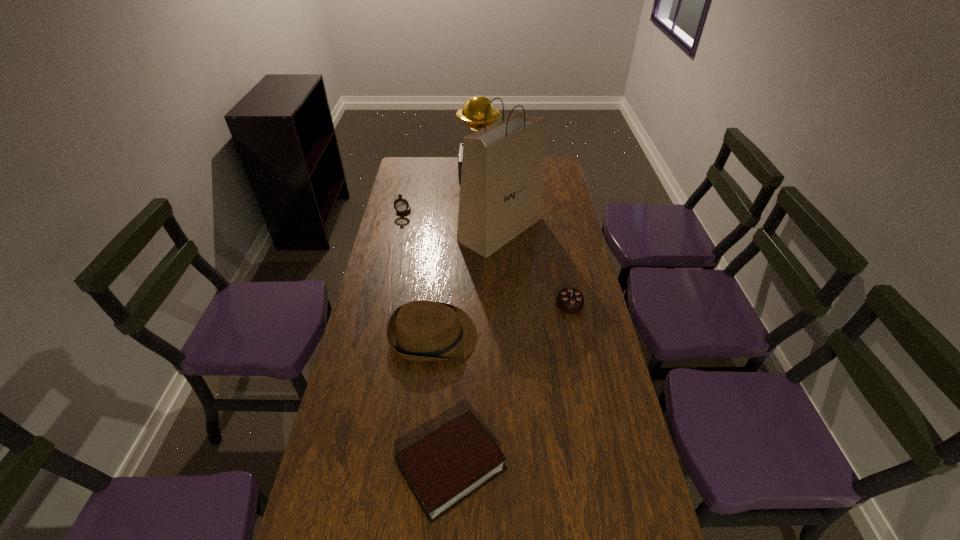
Where is `free space that is in between the fedora and the compass`? The image size is (960, 540). free space that is in between the fedora and the compass is located at coordinates click(419, 273).

Where is `vacant area that lies between the leftmost object and the fedora`? This screenshot has height=540, width=960. vacant area that lies between the leftmost object and the fedora is located at coordinates (419, 273).

The width and height of the screenshot is (960, 540). What are the coordinates of `free point between the chocolate cake and the tallest object` in the screenshot? It's located at (535, 267).

Where is `vacant area that lies between the award and the fedora`? vacant area that lies between the award and the fedora is located at coordinates (456, 254).

I want to click on free space that is in between the shopping bag and the compass, so [452, 219].

This screenshot has width=960, height=540. What are the coordinates of `free space between the compass and the second tallest object` in the screenshot? It's located at (442, 191).

The image size is (960, 540). What are the coordinates of `free spot between the award and the chocolate cake` in the screenshot? It's located at (524, 238).

You are a GUI agent. You are given a task and a screenshot of the screen. Output one action in this format:
    pyautogui.click(x=<x>, y=<y>)
    Task: Click on the free point between the chocolate cake and the tallest object
    This screenshot has height=540, width=960.
    Given the screenshot: What is the action you would take?
    click(535, 267)

Find the location of a particular element. Image resolution: width=960 pixels, height=540 pixels. object that is the closest to the farthest object is located at coordinates [x=501, y=179].

Choose which object is the fifth nearest neighbor to the fedora. Please provide its 2D coordinates. Your answer should be formatted as a tuple, i.e. [(x, y)], where the tuple contains the x and y coordinates of a point satisfying the conditions above.

[(473, 112)]